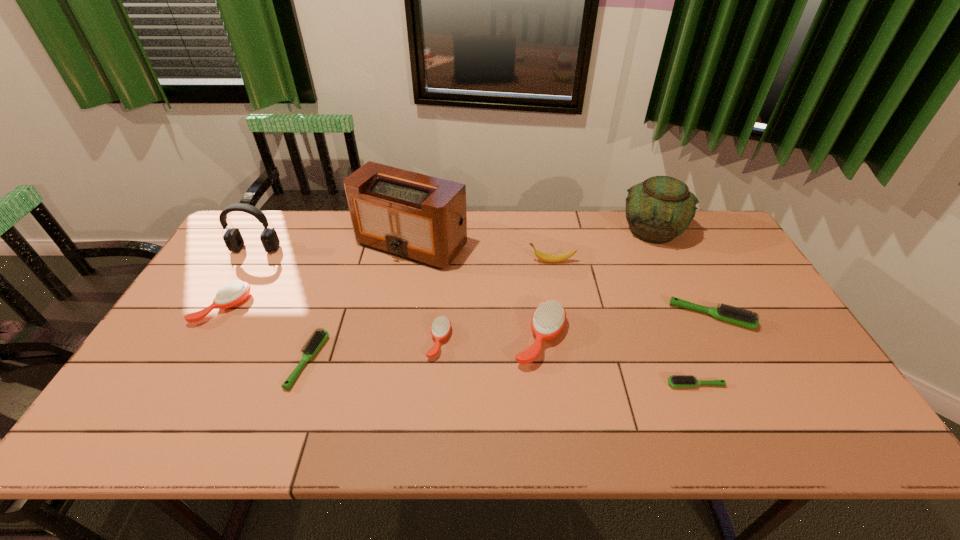
Locate an element on the screen. headset that is at the left edge is located at coordinates [233, 239].

I want to click on hairbrush present at the left edge, so click(x=233, y=293).

Where is `pottery present at the right edge`? This screenshot has height=540, width=960. pottery present at the right edge is located at coordinates (659, 209).

The height and width of the screenshot is (540, 960). Find the location of `hairbrush at the right edge`. hairbrush at the right edge is located at coordinates (742, 317).

The height and width of the screenshot is (540, 960). What are the coordinates of `object positioned at the far left corner` in the screenshot? It's located at (233, 239).

This screenshot has width=960, height=540. I want to click on object at the far right corner, so [x=659, y=209].

Find the location of `free space at the far edge of the desktop`. free space at the far edge of the desktop is located at coordinates (570, 216).

Identify the location of free region at the near edge. (698, 439).

The height and width of the screenshot is (540, 960). I want to click on vacant space at the left edge of the desktop, so click(155, 382).

At what (x,y) coordinates should I click in order to perform the action: click on vacant space at the right edge of the desktop. Please return your answer as a coordinate pair (x, y). Looking at the image, I should click on (737, 268).